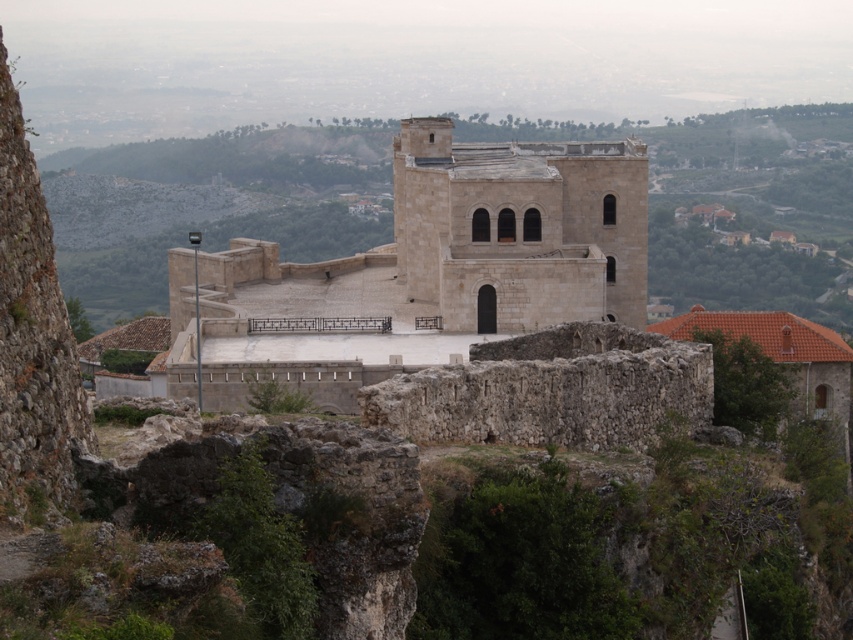
You are a tour guide explaining the historical site to visitors. You mention both the beige stone castle at center and the white stone tower at center. Which structure is larger?

The beige stone castle at center is bigger than the white stone tower at center.

You are a tourist standing at the point marked as point (x=425, y=269). Which structure are you currently located on?

The point (x=425, y=269) is on beige stone castle at center, so you are currently located on the beige stone castle at center.